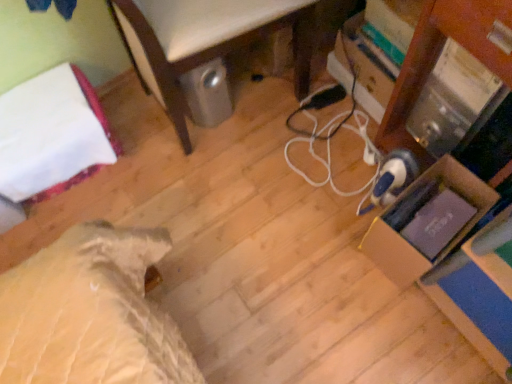
You are a GUI agent. You are given a task and a screenshot of the screen. Output one action in this format:
    pyautogui.click(x=<x>, y=<y>)
    Task: Click on the free space in front of cardboard box at right
    
    Given the screenshot: What is the action you would take?
    tap(416, 330)